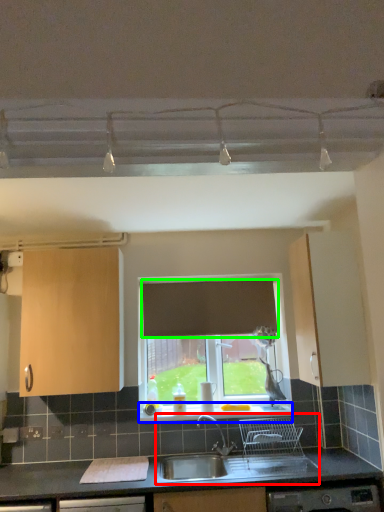
Question: Which object is the farthest from sink (highlighted by a red box)? Choose among these: window sill (highlighted by a blue box) or curtain (highlighted by a green box).

Choices:
 (A) window sill
 (B) curtain

Answer: (B)